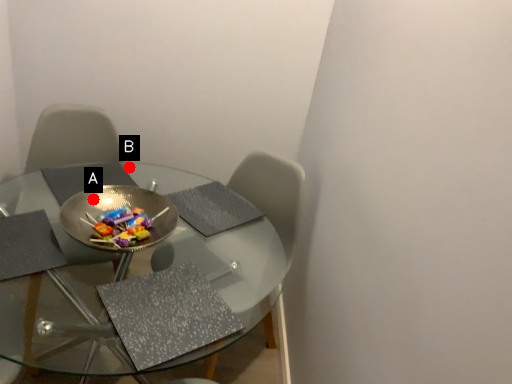
Question: Two points are circled on the image, labeled by A and B beside each circle. Which point is closer to the camera taking this photo?

Choices:
 (A) A is closer
 (B) B is closer

Answer: (A)